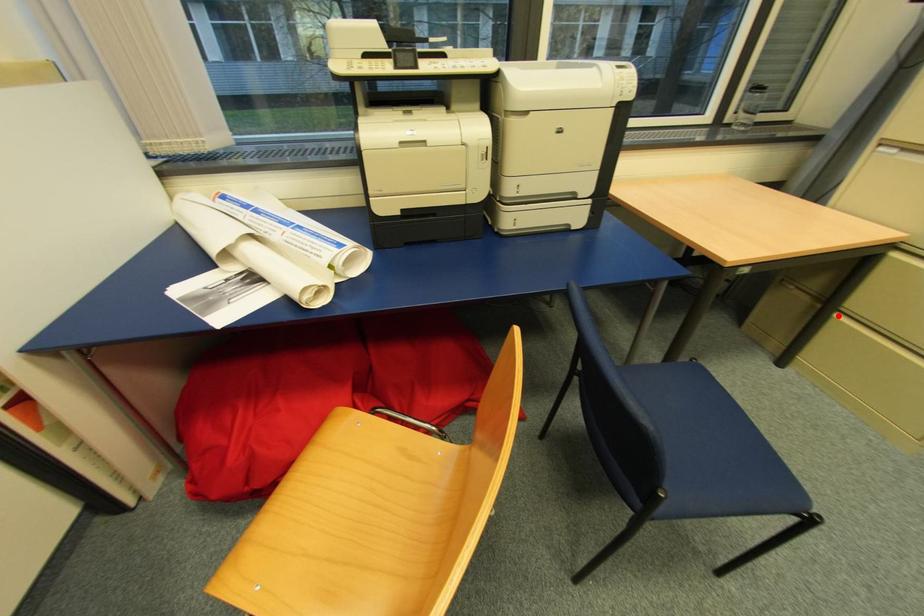
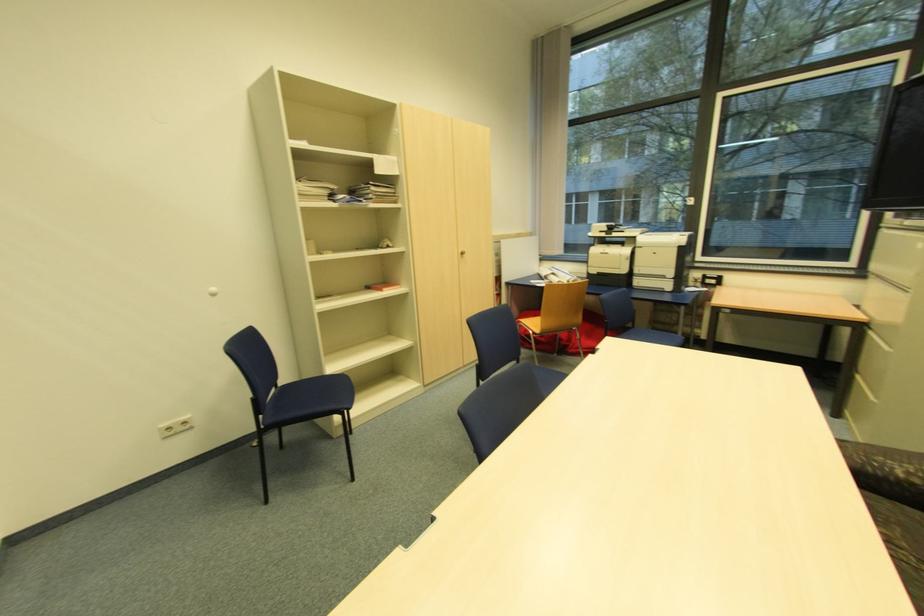
Find the pixel in the second image that matches the highlighted location in the first image.

(860, 377)